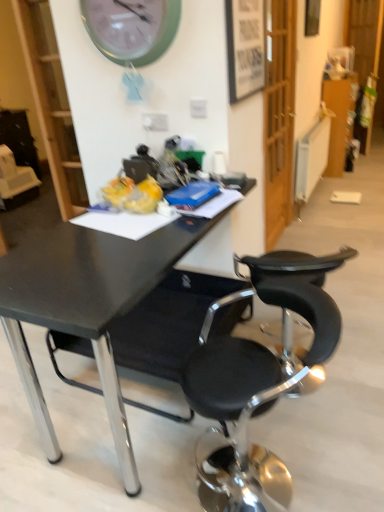
Question: Which direction should I rotate to look at wooden framed poster at upper center, which is the 1th picture frame from left to right, — up or down?

Choices:
 (A) down
 (B) up

Answer: (B)

Question: Can you confirm if wooden framed poster at upper center, acting as the 2th picture frame starting from the top, is wider than wooden picture frame at upper right, the 2th picture frame when ordered from bottom to top?

Choices:
 (A) no
 (B) yes

Answer: (A)

Question: Is wooden framed poster at upper center, which is counted as the 1th picture frame, starting from the front, placed right next to wooden picture frame at upper right, marked as the 2th picture frame in a left-to-right arrangement?

Choices:
 (A) yes
 (B) no

Answer: (B)

Question: From the image's perspective, is wooden framed poster at upper center, the second picture frame in the right-to-left sequence, beneath wooden picture frame at upper right, which appears as the first picture frame when viewed from the back?

Choices:
 (A) no
 (B) yes

Answer: (B)

Question: Is wooden framed poster at upper center, which is the 1th picture frame from left to right, shorter than wooden picture frame at upper right, which appears as the first picture frame when viewed from the back?

Choices:
 (A) no
 (B) yes

Answer: (A)

Question: Is wooden framed poster at upper center, which is the 1th picture frame from left to right, looking in the opposite direction of wooden picture frame at upper right, arranged as the 2th picture frame when viewed from the front?

Choices:
 (A) yes
 (B) no

Answer: (B)

Question: Would you say wooden framed poster at upper center, the second picture frame in the right-to-left sequence, is outside wooden picture frame at upper right, which appears as the first picture frame when viewed from the back?

Choices:
 (A) yes
 (B) no

Answer: (A)

Question: Considering the relative sizes of black matte desk at center and wooden framed poster at upper center, which is counted as the 1th picture frame, starting from the front, in the image provided, is black matte desk at center thinner than wooden framed poster at upper center, which is counted as the 1th picture frame, starting from the front,?

Choices:
 (A) no
 (B) yes

Answer: (A)

Question: From a real-world perspective, does black matte desk at center sit lower than wooden framed poster at upper center, which is counted as the 2th picture frame, starting from the back?

Choices:
 (A) yes
 (B) no

Answer: (A)

Question: Is black matte desk at center at the left side of wooden framed poster at upper center, the second picture frame in the right-to-left sequence?

Choices:
 (A) no
 (B) yes

Answer: (B)

Question: Is black matte desk at center turned away from wooden framed poster at upper center, which is counted as the 1th picture frame, starting from the front?

Choices:
 (A) yes
 (B) no

Answer: (B)

Question: Is black matte desk at center oriented towards wooden framed poster at upper center, which is counted as the 2th picture frame, starting from the back?

Choices:
 (A) yes
 (B) no

Answer: (B)

Question: From a real-world perspective, is black matte desk at center on top of wooden framed poster at upper center, the second picture frame in the right-to-left sequence?

Choices:
 (A) yes
 (B) no

Answer: (B)

Question: Can you confirm if wooden framed poster at upper center, which is counted as the 1th picture frame, starting from the front, is wider than white glossy bookshelf at upper left?

Choices:
 (A) no
 (B) yes

Answer: (A)